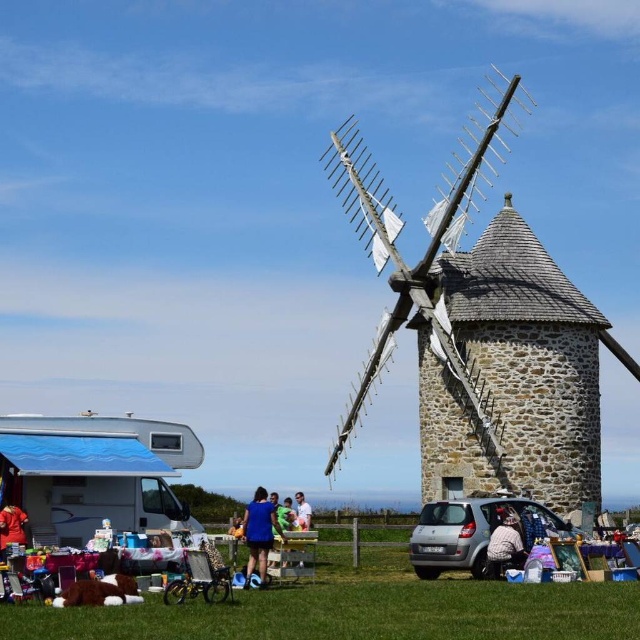
Question: Considering the real-world distances, which object is farthest from the white cotton shirt at lower center?

Choices:
 (A) red fabric dress at lower left
 (B) silver metallic car at lower center
 (C) wooden windmill at center

Answer: (A)

Question: Can you confirm if blue fabric shirt at center is positioned to the right of red fabric dress at lower left?

Choices:
 (A) yes
 (B) no

Answer: (A)

Question: Which object is positioned farthest from the silver metallic car at lower center?

Choices:
 (A) wooden windmill at center
 (B) red fabric dress at lower left
 (C) white cotton shirt at lower center

Answer: (B)

Question: Considering the real-world distances, which object is closest to the red fabric dress at lower left?

Choices:
 (A) wooden windmill at center
 (B) white cotton shirt at lower center
 (C) blue fabric shirt at center

Answer: (C)

Question: Is wooden windmill at center above silver metallic car at lower center?

Choices:
 (A) yes
 (B) no

Answer: (A)

Question: Is silver metallic car at lower center positioned in front of blue fabric shirt at center?

Choices:
 (A) yes
 (B) no

Answer: (B)